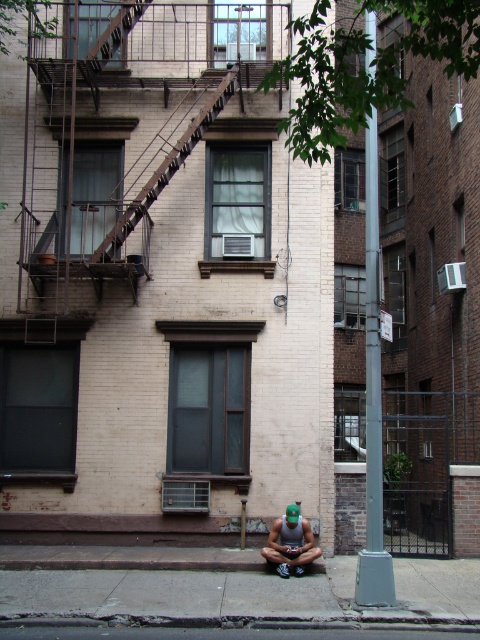
Measure the distance between smooth concrete pavement at lower center and camera.

23.57 feet

Describe the element at coordinates (240, 632) in the screenshot. The height and width of the screenshot is (640, 480). I see `smooth concrete pavement at lower center` at that location.

This screenshot has height=640, width=480. I want to click on smooth concrete pavement at lower center, so click(240, 632).

Which is in front, point (307, 611) or point (300, 540)?

Point (307, 611) is in front.

Is point (213, 605) closer to camera compared to point (286, 534)?

Yes, it is in front of point (286, 534).

Identify the location of gray concrete pavement at lower center. The image size is (480, 640). (238, 596).

Is the position of gray concrete pavement at lower center more distant than that of rusty metal fire escape at upper center?

No, it is in front of rusty metal fire escape at upper center.

Can you confirm if gray concrete pavement at lower center is shorter than rusty metal fire escape at upper center?

Indeed, gray concrete pavement at lower center has a lesser height compared to rusty metal fire escape at upper center.

Is point (415, 620) positioned in front of point (208, 113)?

Yes.

Locate an element on the screen. This screenshot has height=640, width=480. gray concrete pavement at lower center is located at coordinates (238, 596).